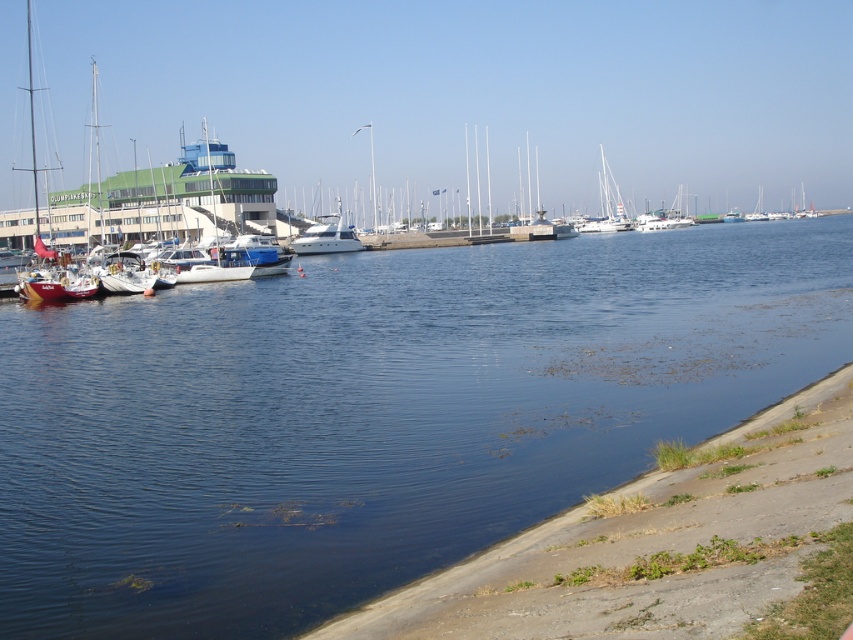
Can you confirm if blue water at center is shorter than white glossy yacht at center?

Indeed, blue water at center has a lesser height compared to white glossy yacht at center.

Does point (508, 378) come behind point (311, 227)?

No, (508, 378) is in front of (311, 227).

This screenshot has width=853, height=640. What are the coordinates of `blue water at center` in the screenshot? It's located at (375, 413).

Which is above, blue water at center or matte white sailboat at left?

Positioned higher is matte white sailboat at left.

Who is more forward, (581, 388) or (334, 8)?

Point (581, 388) is in front.

Locate an element on the screen. blue water at center is located at coordinates (375, 413).

Is matte white sailboat at left thinner than white glossy sailboat at center?

No, matte white sailboat at left is not thinner than white glossy sailboat at center.

Does matte white sailboat at left lie in front of white glossy sailboat at center?

That is True.

Which is in front, point (51, 124) or point (619, 216)?

Point (619, 216) is more forward.

Locate an element on the screen. The height and width of the screenshot is (640, 853). matte white sailboat at left is located at coordinates (463, 93).